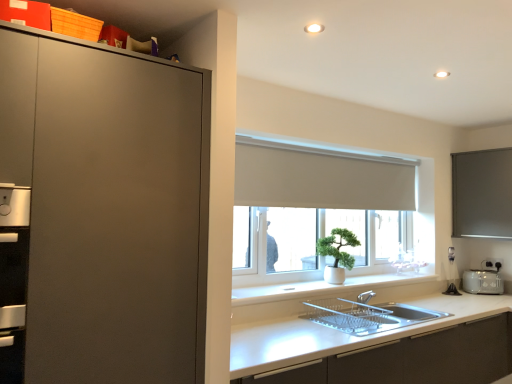
Question: Is white smooth window sill at center taller than white matte window at center?

Choices:
 (A) yes
 (B) no

Answer: (B)

Question: Is white smooth window sill at center aimed at white matte window at center?

Choices:
 (A) yes
 (B) no

Answer: (B)

Question: Is white smooth window sill at center not within white matte window at center?

Choices:
 (A) yes
 (B) no

Answer: (A)

Question: Is white smooth window sill at center far from white matte window at center?

Choices:
 (A) no
 (B) yes

Answer: (A)

Question: Can you confirm if white smooth window sill at center is bigger than white matte window at center?

Choices:
 (A) no
 (B) yes

Answer: (A)

Question: Is white matte window at center located within white smooth window sill at center?

Choices:
 (A) no
 (B) yes

Answer: (A)

Question: Is white matte cabinet at lower center smaller than matte gray window screen at right?

Choices:
 (A) yes
 (B) no

Answer: (B)

Question: Is white matte cabinet at lower center to the right of matte gray window screen at right from the viewer's perspective?

Choices:
 (A) no
 (B) yes

Answer: (A)

Question: From the image's perspective, is white matte cabinet at lower center on top of matte gray window screen at right?

Choices:
 (A) yes
 (B) no

Answer: (B)

Question: Is white matte cabinet at lower center to the left of matte gray window screen at right from the viewer's perspective?

Choices:
 (A) no
 (B) yes

Answer: (B)

Question: Does white matte cabinet at lower center have a lesser height compared to matte gray window screen at right?

Choices:
 (A) yes
 (B) no

Answer: (B)

Question: Is white matte cabinet at lower center surrounding matte gray window screen at right?

Choices:
 (A) no
 (B) yes

Answer: (A)

Question: Is white matte window at center taller than matte gray window screen at right?

Choices:
 (A) no
 (B) yes

Answer: (B)